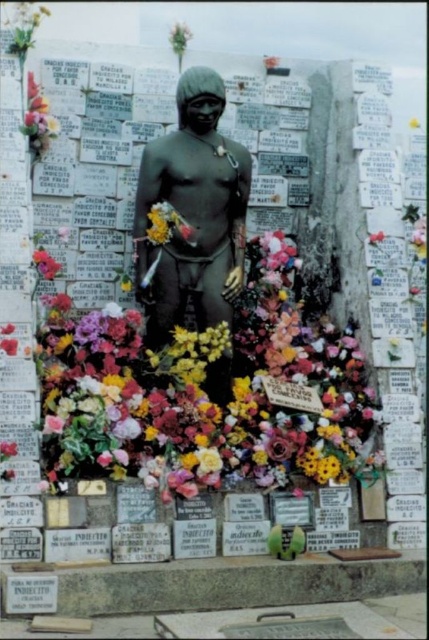
Which of these two, fluffy silk flowers at center or bronze statue at center, stands taller?

bronze statue at center

Is fluffy silk flowers at center shorter than bronze statue at center?

Yes.

The image size is (429, 640). What do you see at coordinates (205, 394) in the screenshot? I see `fluffy silk flowers at center` at bounding box center [205, 394].

Image resolution: width=429 pixels, height=640 pixels. What are the coordinates of `fluffy silk flowers at center` in the screenshot? It's located at (205, 394).

You are a GUI agent. You are given a task and a screenshot of the screen. Output one action in this format:
    pyautogui.click(x=<x>, y=<y>)
    Task: Click on the bronze statue at center
    
    Given the screenshot: What is the action you would take?
    pyautogui.click(x=193, y=212)

Can you confirm if bronze statue at center is bigger than floral bouquet at upper left?

Correct, bronze statue at center is larger in size than floral bouquet at upper left.

Measure the distance between point (201,284) and camera.

Point (201,284) and camera are 162.93 feet apart from each other.

At what (x,y) coordinates should I click in order to perform the action: click on bronze statue at center. Please return your answer as a coordinate pair (x, y). Image resolution: width=429 pixels, height=640 pixels. Looking at the image, I should click on (193, 212).

Can you confirm if fluffy silk flowers at center is thinner than floral bouquet at upper left?

Incorrect, fluffy silk flowers at center's width is not less than floral bouquet at upper left's.

Does fluffy silk flowers at center have a lesser height compared to floral bouquet at upper left?

Incorrect, fluffy silk flowers at center's height does not fall short of floral bouquet at upper left's.

Does point (50, 410) come farther from viewer compared to point (41, 122)?

That is False.

The width and height of the screenshot is (429, 640). Identify the location of fluffy silk flowers at center. (205, 394).